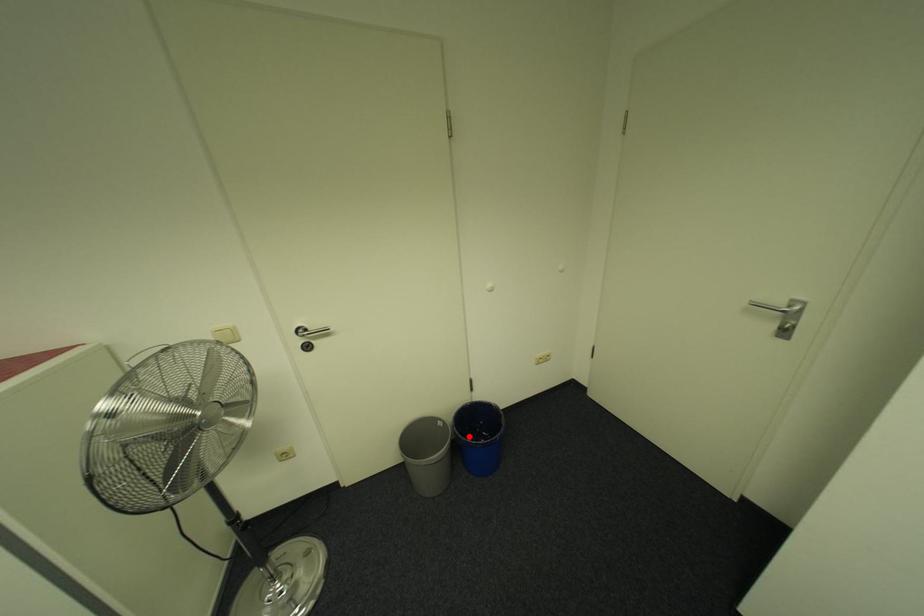
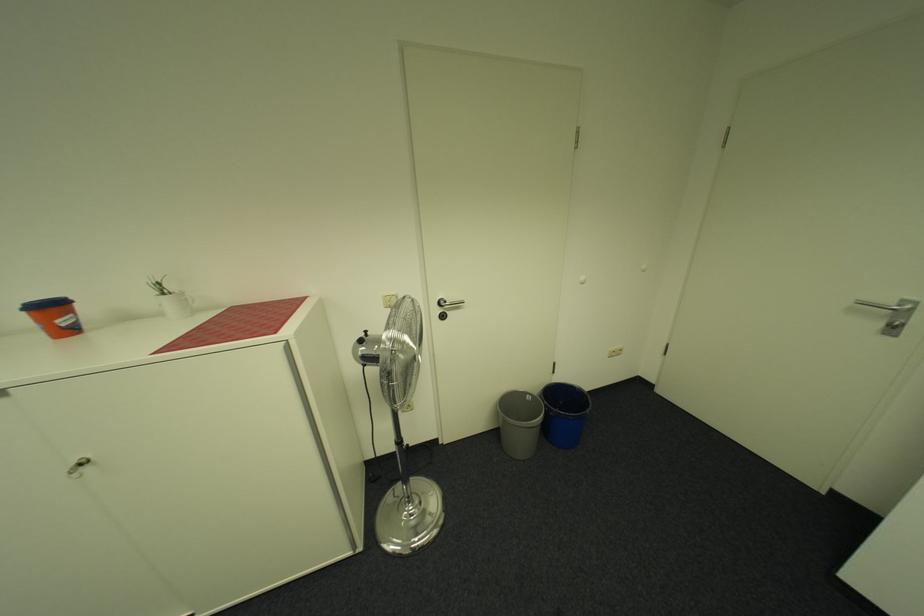
The point at the highlighted location is marked in the first image. Where is the corresponding point in the second image?

(562, 408)